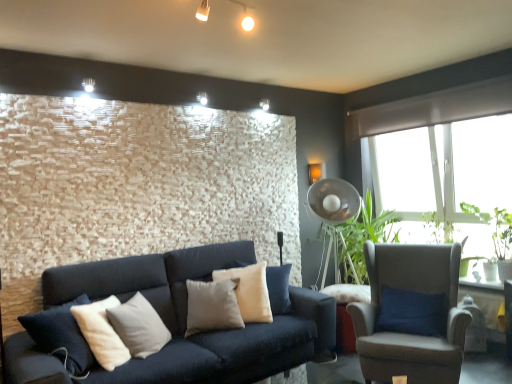
Question: Should I look upward or downward to see green leafy plant at right, placed as the 1th plant when sorted from front to back?

Choices:
 (A) down
 (B) up

Answer: (A)

Question: Does light beige fabric armchair at right have a smaller size compared to beige fabric pillow at center?

Choices:
 (A) no
 (B) yes

Answer: (A)

Question: Is light beige fabric armchair at right bigger than beige fabric pillow at center?

Choices:
 (A) no
 (B) yes

Answer: (B)

Question: Is light beige fabric armchair at right far from beige fabric pillow at center?

Choices:
 (A) no
 (B) yes

Answer: (B)

Question: Is the depth of light beige fabric armchair at right less than that of beige fabric pillow at center?

Choices:
 (A) no
 (B) yes

Answer: (B)

Question: From a real-world perspective, is light beige fabric armchair at right over beige fabric pillow at center?

Choices:
 (A) yes
 (B) no

Answer: (B)

Question: From the image's perspective, is light beige fabric armchair at right located above beige fabric pillow at center?

Choices:
 (A) no
 (B) yes

Answer: (A)

Question: Considering the relative positions of green leafy plant at right, marked as the second plant in a front-to-back arrangement, and beige fabric pillow at center in the image provided, is green leafy plant at right, marked as the second plant in a front-to-back arrangement, to the right of beige fabric pillow at center from the viewer's perspective?

Choices:
 (A) no
 (B) yes

Answer: (B)

Question: Is green leafy plant at right, marked as the second plant in a front-to-back arrangement, thinner than beige fabric pillow at center?

Choices:
 (A) no
 (B) yes

Answer: (B)

Question: Is beige fabric pillow at center inside green leafy plant at right, the 1th plant from the back?

Choices:
 (A) no
 (B) yes

Answer: (A)

Question: Considering the relative sizes of green leafy plant at right, marked as the second plant in a front-to-back arrangement, and beige fabric pillow at center in the image provided, is green leafy plant at right, marked as the second plant in a front-to-back arrangement, wider than beige fabric pillow at center?

Choices:
 (A) no
 (B) yes

Answer: (A)

Question: Is green leafy plant at right, the 1th plant from the back, located outside beige fabric pillow at center?

Choices:
 (A) no
 (B) yes

Answer: (B)

Question: Does green leafy plant at right, the 1th plant from the back, turn towards beige fabric pillow at center?

Choices:
 (A) yes
 (B) no

Answer: (A)

Question: Considering the relative sizes of green leafy plant at right, placed as the 1th plant when sorted from front to back, and green leafy plant at right, marked as the second plant in a front-to-back arrangement, in the image provided, is green leafy plant at right, placed as the 1th plant when sorted from front to back, bigger than green leafy plant at right, marked as the second plant in a front-to-back arrangement,?

Choices:
 (A) yes
 (B) no

Answer: (A)